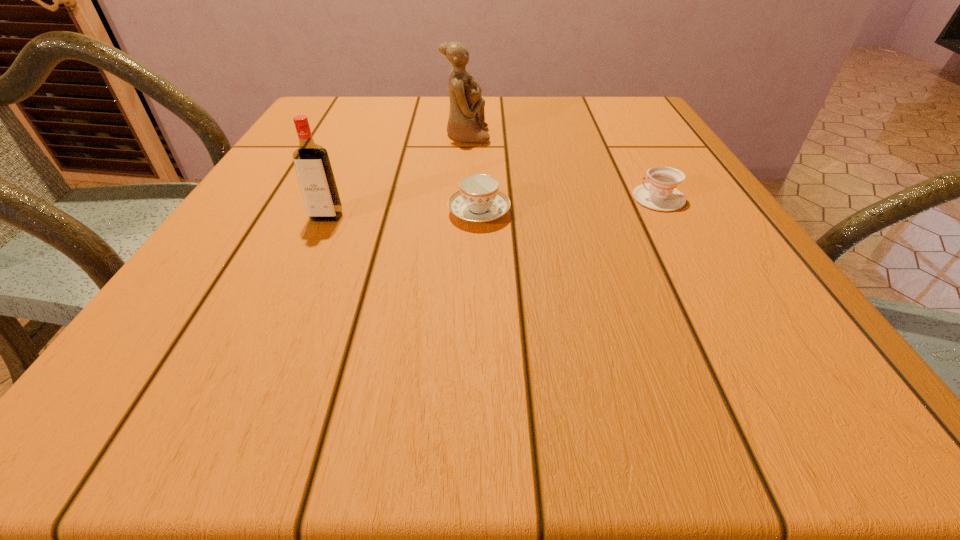
Identify the location of blank space located on the side with the handle of the left teacup. The width and height of the screenshot is (960, 540). (479, 139).

Identify the location of vacant space located on the handle side of the right teacup. (534, 198).

I want to click on free space located 0.140m on the handle side of the right teacup, so (x=561, y=198).

You are a GUI agent. You are given a task and a screenshot of the screen. Output one action in this format:
    pyautogui.click(x=<x>, y=<y>)
    Task: Click on the free location located 0.320m on the handle side of the right teacup
    
    Given the screenshot: What is the action you would take?
    pyautogui.click(x=467, y=198)

Image resolution: width=960 pixels, height=540 pixels. Find the location of `object at the far edge`. object at the far edge is located at coordinates (466, 121).

This screenshot has height=540, width=960. What are the coordinates of `object located in the left edge section of the desktop` in the screenshot? It's located at (315, 175).

Where is `object situated at the right edge`? This screenshot has height=540, width=960. object situated at the right edge is located at coordinates (660, 194).

The height and width of the screenshot is (540, 960). In the image, there is a desktop. Find the location of `free space at the far edge`. free space at the far edge is located at coordinates (542, 119).

Find the location of a particular element. The width and height of the screenshot is (960, 540). free space at the near edge is located at coordinates (550, 410).

In the image, there is a desktop. Where is `vacant region at the left edge`? The width and height of the screenshot is (960, 540). vacant region at the left edge is located at coordinates (211, 254).